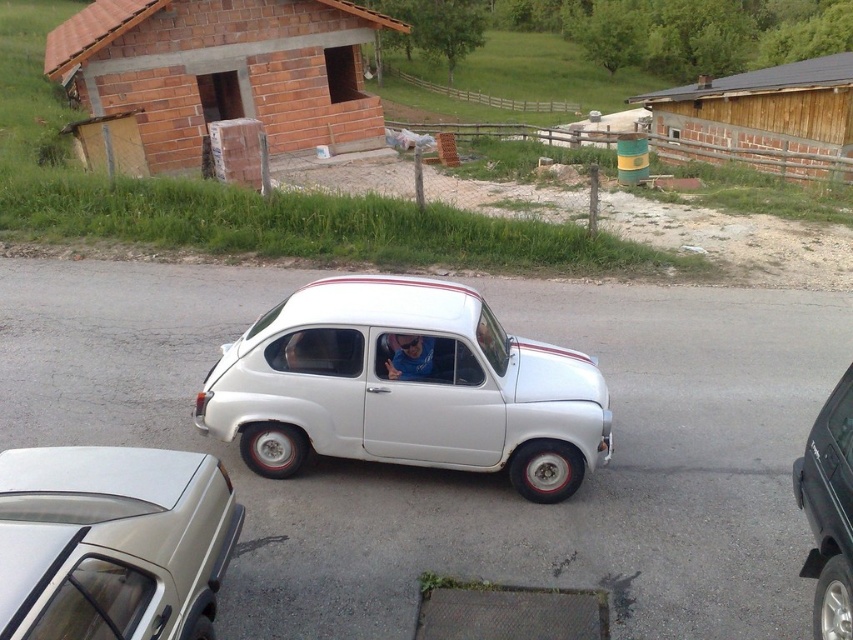
You are trying to park your car in the driveway shown in the image. The white matte car at center is already parked. Can you park your car next to it without overlapping any other objects like the brick hut at upper left?

The white matte car at center occupies less space than brick hut at upper left, so there might be enough space to park next to it without overlapping the brick hut at upper left. However, the exact feasibility depends on the available space between them.